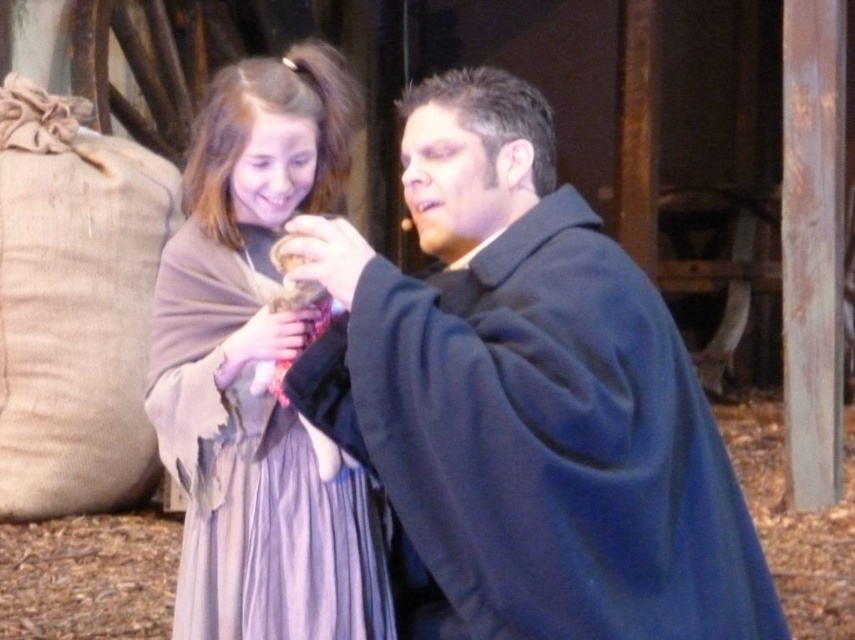
Can you confirm if dark blue woolen robe at center is thinner than light brown woolen shawl at center?

No.

Is point (429, 428) behind point (269, 326)?

No, it is in front of (269, 326).

Is point (616, 276) farther from viewer compared to point (233, 621)?

No, it is not.

The width and height of the screenshot is (855, 640). Find the location of `dark blue woolen robe at center`. dark blue woolen robe at center is located at coordinates (526, 397).